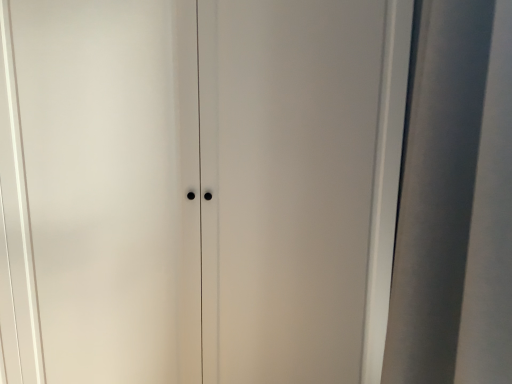
Question: Should I look upward or downward to see satin silver screen door at right?

Choices:
 (A) up
 (B) down

Answer: (B)